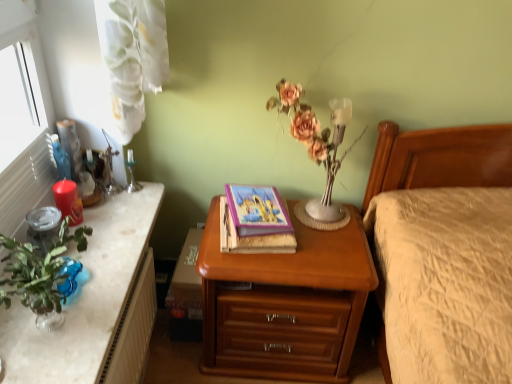
Locate an element on the screen. The height and width of the screenshot is (384, 512). blank area beneath matte pink flowers at center (from a real-world perspective) is located at coordinates (316, 213).